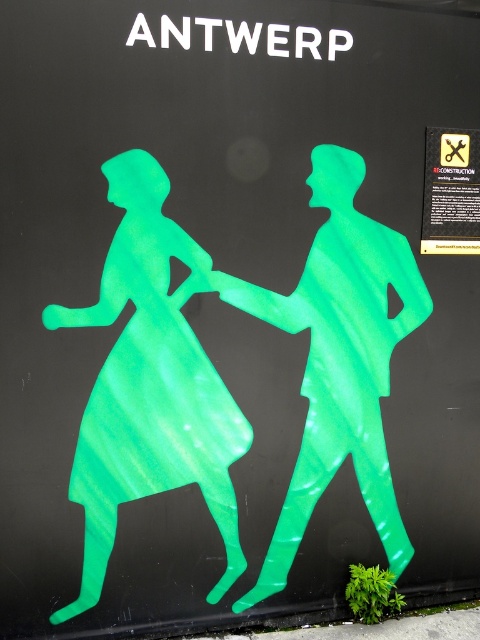
Question: In this image, where is green translucent figure at left located relative to green translucent figure at center?

Choices:
 (A) right
 (B) left

Answer: (B)

Question: Among these objects, which one is nearest to the camera?

Choices:
 (A) green translucent figure at center
 (B) green translucent figure at left

Answer: (B)

Question: Can you confirm if green translucent figure at left is positioned above green translucent figure at center?

Choices:
 (A) no
 (B) yes

Answer: (A)

Question: Can you confirm if green translucent figure at left is positioned to the right of green translucent figure at center?

Choices:
 (A) yes
 (B) no

Answer: (B)